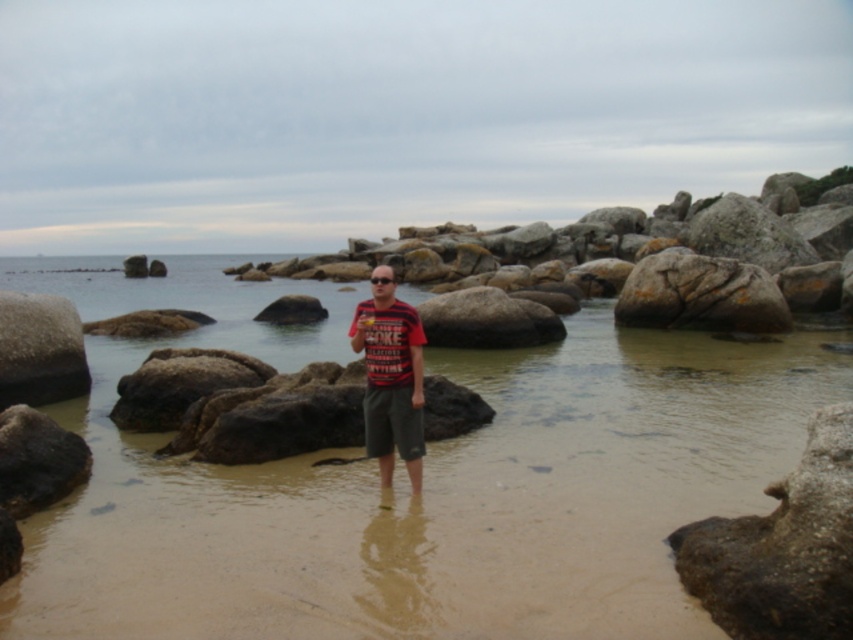
Question: Which object is closer to the camera taking this photo?

Choices:
 (A) smooth gray rock at left
 (B) smooth gray rock at lower right

Answer: (B)

Question: Can you confirm if smooth gray rock at lower right is positioned below smooth gray rock at left?

Choices:
 (A) yes
 (B) no

Answer: (A)

Question: In this image, where is brown sand at center located relative to smooth gray rock at lower right?

Choices:
 (A) left
 (B) right

Answer: (A)

Question: Estimate the real-world distances between objects in this image. Which object is farther from the smooth gray rock at left?

Choices:
 (A) red striped shirt at center
 (B) smooth gray rock at center

Answer: (B)

Question: Does smooth gray rock at lower right appear over red striped shirt at center?

Choices:
 (A) yes
 (B) no

Answer: (B)

Question: Among these points, which one is nearest to the camera?

Choices:
 (A) (751, 269)
 (B) (409, 388)
 (C) (64, 356)
 (D) (344, 573)

Answer: (D)